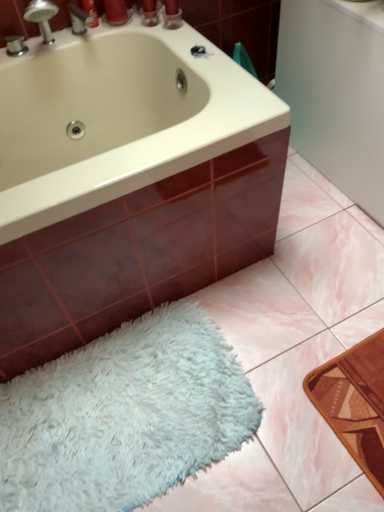
Question: Is white fluffy bath mat at lower left thinner than white glossy bathtub at upper left?

Choices:
 (A) no
 (B) yes

Answer: (B)

Question: Is white fluffy bath mat at lower left placed right next to white glossy bathtub at upper left?

Choices:
 (A) yes
 (B) no

Answer: (B)

Question: Considering the relative positions of white fluffy bath mat at lower left and white glossy bathtub at upper left in the image provided, is white fluffy bath mat at lower left to the left of white glossy bathtub at upper left from the viewer's perspective?

Choices:
 (A) no
 (B) yes

Answer: (A)

Question: Is white glossy bathtub at upper left a part of white fluffy bath mat at lower left?

Choices:
 (A) no
 (B) yes

Answer: (A)

Question: Is white fluffy bath mat at lower left oriented away from white glossy bathtub at upper left?

Choices:
 (A) yes
 (B) no

Answer: (B)

Question: Can you confirm if white fluffy bath mat at lower left is taller than white glossy bathtub at upper left?

Choices:
 (A) no
 (B) yes

Answer: (A)

Question: Is white fluffy bath mat at lower left wider than brushed metal faucet at upper left?

Choices:
 (A) yes
 (B) no

Answer: (A)

Question: From a real-world perspective, is white fluffy bath mat at lower left on brushed metal faucet at upper left?

Choices:
 (A) no
 (B) yes

Answer: (A)

Question: Is brushed metal faucet at upper left completely or partially inside white fluffy bath mat at lower left?

Choices:
 (A) yes
 (B) no

Answer: (B)

Question: Can you confirm if white fluffy bath mat at lower left is taller than brushed metal faucet at upper left?

Choices:
 (A) no
 (B) yes

Answer: (A)

Question: Does white fluffy bath mat at lower left turn towards brushed metal faucet at upper left?

Choices:
 (A) no
 (B) yes

Answer: (A)

Question: Does white fluffy bath mat at lower left have a larger size compared to brushed metal faucet at upper left?

Choices:
 (A) yes
 (B) no

Answer: (A)

Question: Considering the relative sizes of brushed metal faucet at upper left and white fluffy bath mat at lower left in the image provided, is brushed metal faucet at upper left wider than white fluffy bath mat at lower left?

Choices:
 (A) yes
 (B) no

Answer: (B)